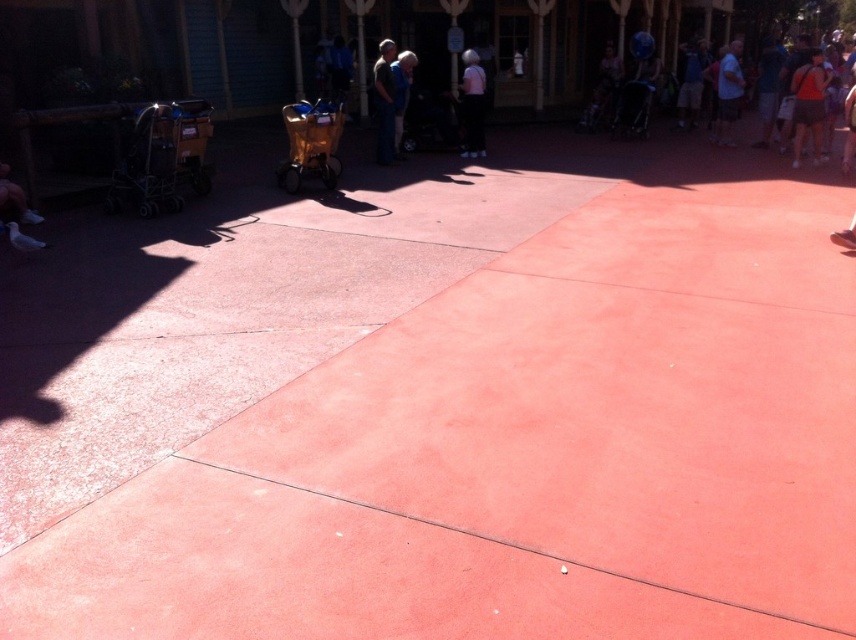
From the picture: You are a parent pushing a child in the gold metallic stroller at center and need to pass through a narrow doorway that is just wide enough for the stroller. Can you also carry the white matte shirt at center with you through the doorway without leaving it behind?

The gold metallic stroller at center is larger in size than the white matte shirt at center. Since the doorway is only wide enough for the stroller, the white matte shirt at center would need to be placed on or attached to the stroller to fit through the doorway together.

You are a parent pushing a gold metallic stroller at center and wearing a white matte shirt at center. You want to avoid getting your shirt dirty from the pavement. Which object should you move first to keep your shirt clean?

The gold metallic stroller at center is positioned under the white matte shirt at center. To keep the shirt clean, you should move the gold metallic stroller at center first so it no longer blocks the shirt from the pavement.